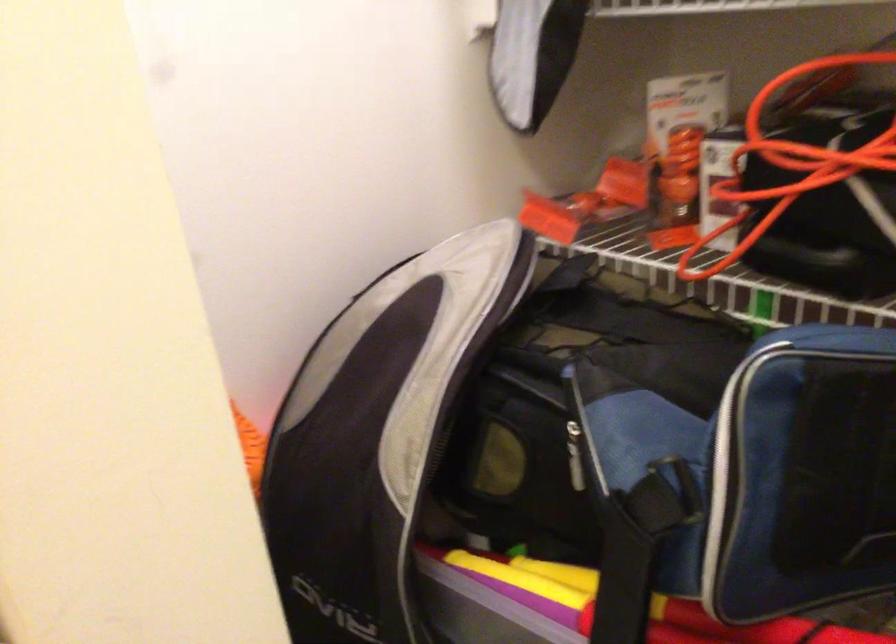
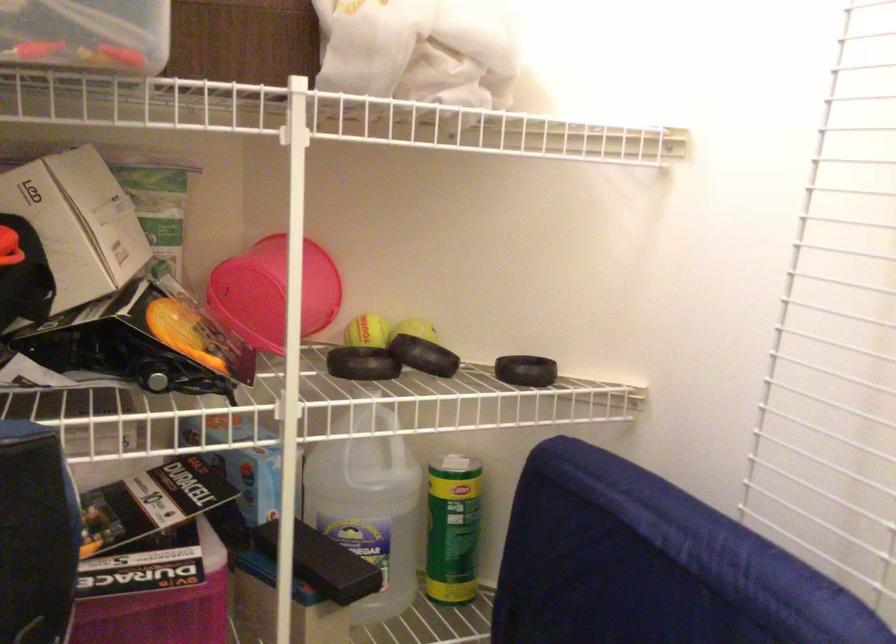
Question: The camera is either moving clockwise (left) or counter-clockwise (right) around the object. The first image is from the beginning of the video and the second image is from the end. Is the camera moving left or right when shooting the video?

Choices:
 (A) Left
 (B) Right

Answer: (A)